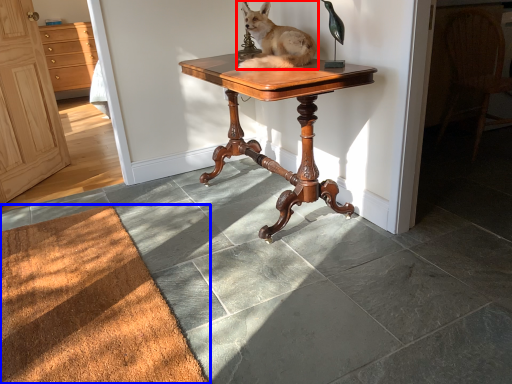
Question: Which object is further to the camera taking this photo, dog (highlighted by a red box) or doormat (highlighted by a blue box)?

Choices:
 (A) dog
 (B) doormat

Answer: (A)